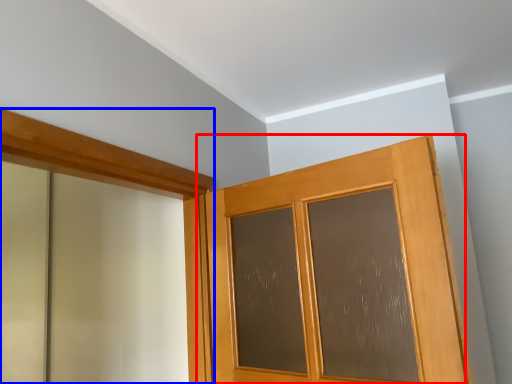
Question: Which of the following is the farthest to the observer, door (highlighted by a red box) or barn door (highlighted by a blue box)?

Choices:
 (A) door
 (B) barn door

Answer: (A)